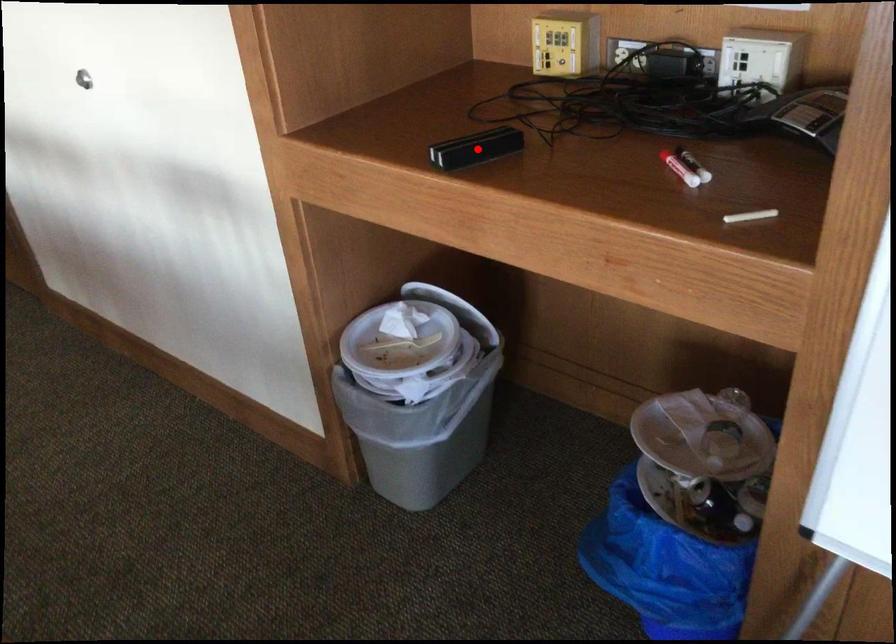
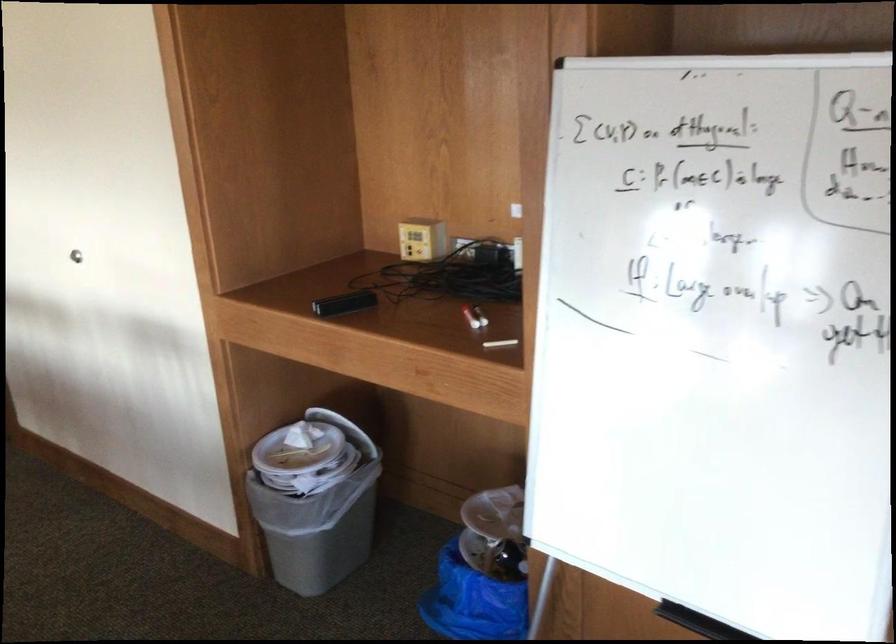
Question: A red point is marked in image1. In image2, is the corresponding 3D point closer to the camera or farther? Reply with the corresponding letter.

Choices:
 (A) The corresponding 3D point is closer.
 (B) The corresponding 3D point is farther.

Answer: (B)